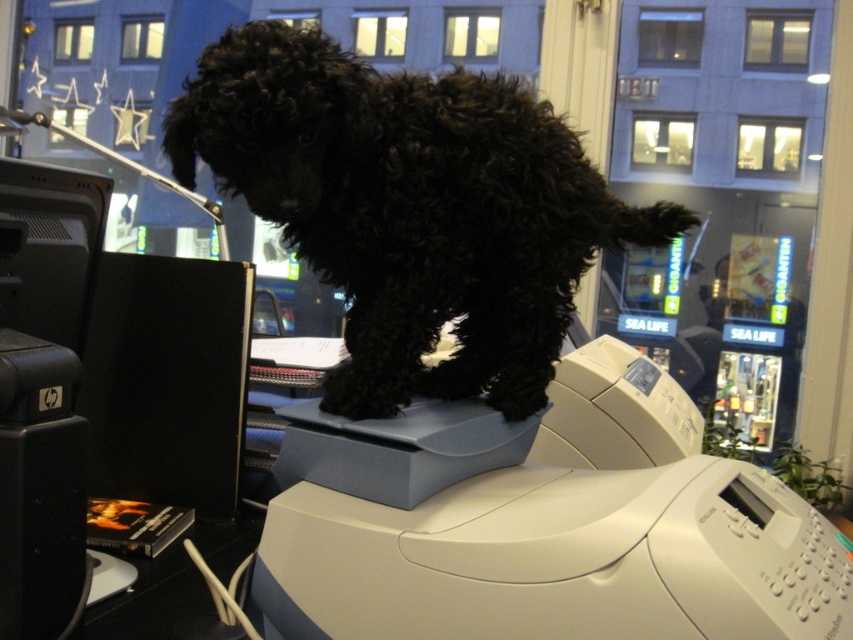
You are an office worker who just arrived at your desk. You see the black curly fur dog at center and the white plastic printer at upper center. Which object is positioned higher in the scene?

The black curly fur dog at center is above the white plastic printer at upper center, so the dog is positioned higher.

You are an interior designer evaluating the placement of furniture in this room. The printer is located at point (563,540). Is the printer positioned in a way that might obstruct the view of the cityscape through the large window?

The printer is located at point (563,540), which corresponds to the white plastic printer at upper center. Since the large window is in the background and the printer is on the desk at upper center, it might partially block the view of the cityscape depending on the viewer angle.

You are standing in front of the desk with the printer and the dog. There are two points marked on the desk. The first point is at coordinates point (299, 186) and the second point is at point (341, 380). Which point is closer to you?

Point (299, 186) is closer to the viewer than point (341, 380).